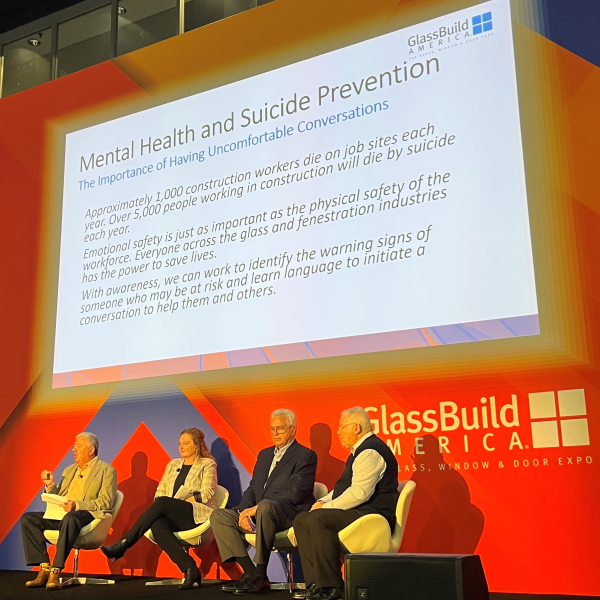
Find the location of a particular element. Image resolution: width=600 pixels, height=600 pixels. screen is located at coordinates (438, 295).